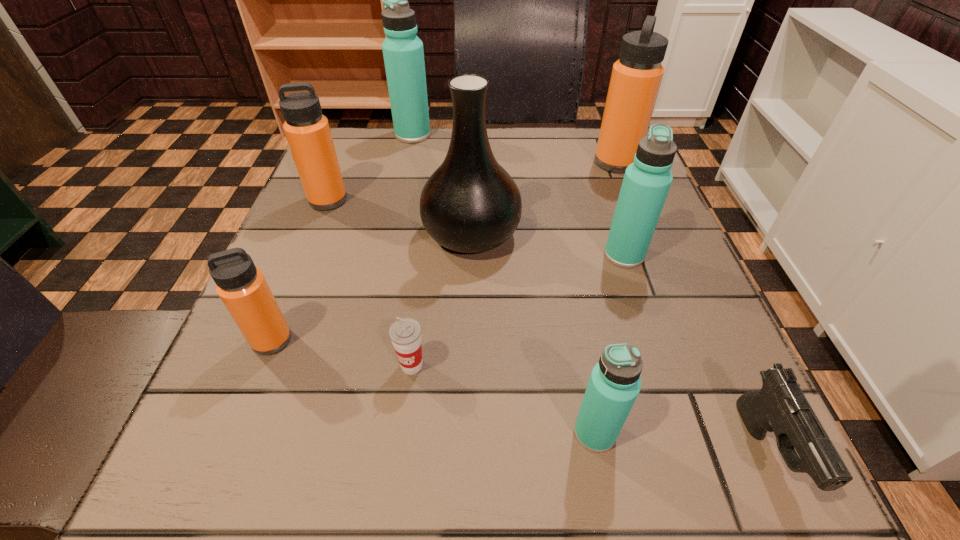
Locate an element on the screen. This screenshot has width=960, height=540. the biggest aqua thermos bottle is located at coordinates (403, 53).

Identify the location of the farthest object. This screenshot has width=960, height=540. (403, 53).

In order to click on the biggest orange thermos bottle in this screenshot , I will do `click(636, 77)`.

What are the coordinates of `the farthest orange thermos bottle` in the screenshot? It's located at (636, 77).

Locate an element on the screen. The image size is (960, 540). vase is located at coordinates (470, 204).

Identify the location of the second smallest orange thermos bottle. (307, 130).

Where is `the second nearest orange thermos bottle`? the second nearest orange thermos bottle is located at coordinates (307, 130).

The image size is (960, 540). Identify the location of the rightmost aqua thermos bottle. (646, 183).

I want to click on the second biggest aqua thermos bottle, so click(x=646, y=183).

Where is `the sixth object from left to right`? The image size is (960, 540). the sixth object from left to right is located at coordinates (614, 384).